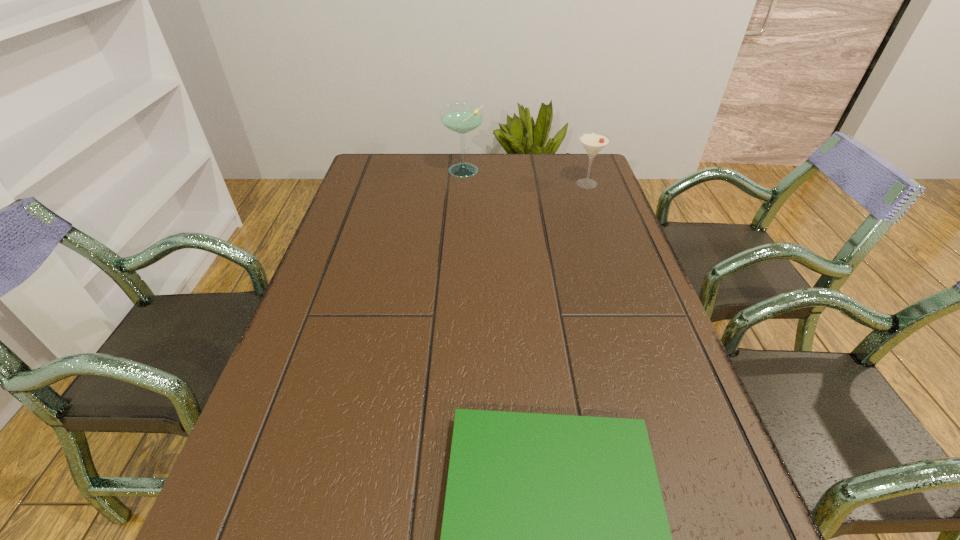
Locate an element on the screen. This screenshot has height=540, width=960. the left martini is located at coordinates (461, 118).

At what (x,y) coordinates should I click in order to perform the action: click on the tallest object. Please return your answer as a coordinate pair (x, y). This screenshot has height=540, width=960. Looking at the image, I should click on (461, 118).

The image size is (960, 540). What are the coordinates of `the second shortest object` in the screenshot? It's located at click(593, 142).

This screenshot has width=960, height=540. Identify the location of the right martini. (593, 142).

You are a GUI agent. You are given a task and a screenshot of the screen. Output one action in this format:
    pyautogui.click(x=<x>, y=<y>)
    Task: Click on the vacant area situated on the back of the taller martini
    The height and width of the screenshot is (540, 960).
    Given the screenshot: What is the action you would take?
    pyautogui.click(x=465, y=154)

The width and height of the screenshot is (960, 540). Identify the location of vacant area located 0.070m on the left of the second tallest object. (549, 184).

In order to click on object located in the right edge section of the desktop in this screenshot , I will do `click(593, 142)`.

Where is `object situated at the far right corner`? The image size is (960, 540). object situated at the far right corner is located at coordinates (593, 142).

At what (x,y) coordinates should I click in order to perform the action: click on free space at the far edge of the desktop. Please return your answer as a coordinate pair (x, y). The height and width of the screenshot is (540, 960). Looking at the image, I should click on (420, 182).

You are a GUI agent. You are given a task and a screenshot of the screen. Output one action in this format:
    pyautogui.click(x=<x>, y=<y>)
    Task: Click on the vacant space at the left edge of the desktop
    The image size is (960, 540).
    Given the screenshot: What is the action you would take?
    pyautogui.click(x=385, y=192)